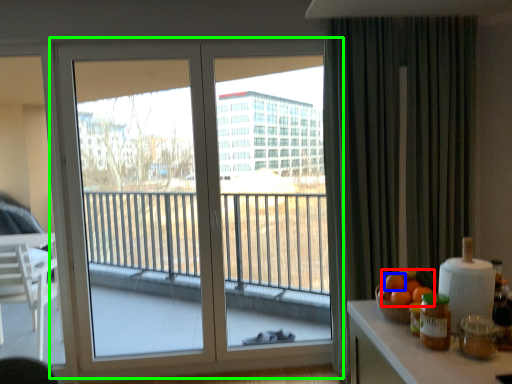
Question: Considering the real-world distances, which object is closest to orange (highlighted by a red box)? orange (highlighted by a blue box) or window (highlighted by a green box).

Choices:
 (A) orange
 (B) window

Answer: (A)